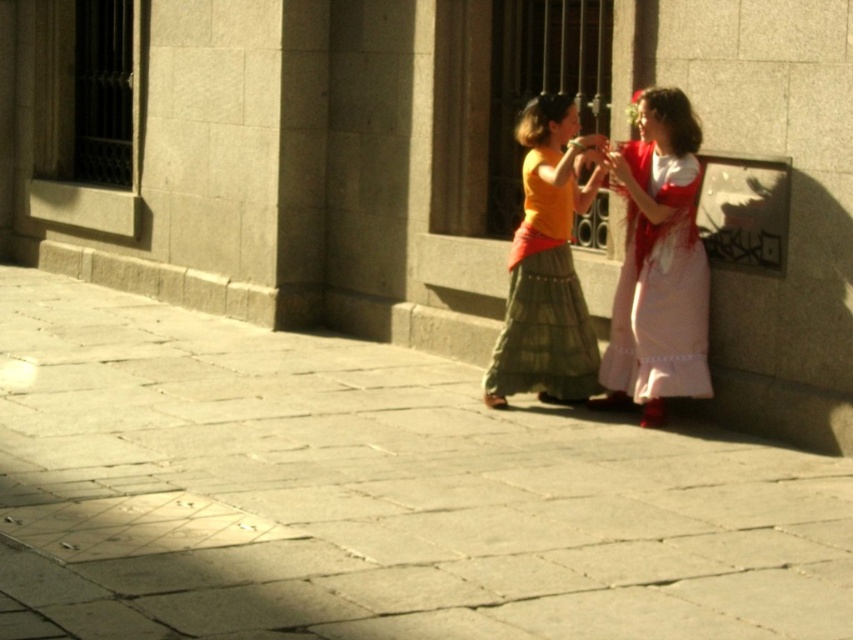
Between smooth stone pavement at center and matte yellow blouse at center, which one appears on the right side from the viewer's perspective?

matte yellow blouse at center is more to the right.

Does smooth stone pavement at center have a lesser height compared to matte yellow blouse at center?

Yes, smooth stone pavement at center is shorter than matte yellow blouse at center.

At what (x,y) coordinates should I click in order to perform the action: click on smooth stone pavement at center. Please return your answer as a coordinate pair (x, y). The height and width of the screenshot is (640, 853). Looking at the image, I should click on (370, 496).

This screenshot has height=640, width=853. I want to click on smooth stone pavement at center, so click(x=370, y=496).

Who is more distant from viewer, (543,618) or (660,256)?

The point (660,256) is more distant.

Between smooth stone pavement at center and matte red dress at center, which one appears on the right side from the viewer's perspective?

matte red dress at center

Image resolution: width=853 pixels, height=640 pixels. Identify the location of smooth stone pavement at center. (370, 496).

Is the position of smooth stone pavement at center more distant than that of silky white flower at upper right?

No, it is in front of silky white flower at upper right.

Who is shorter, smooth stone pavement at center or silky white flower at upper right?

smooth stone pavement at center is shorter.

At what (x,y) coordinates should I click in order to perform the action: click on smooth stone pavement at center. Please return your answer as a coordinate pair (x, y). Looking at the image, I should click on (370, 496).

The width and height of the screenshot is (853, 640). In order to click on smooth stone pavement at center in this screenshot , I will do (370, 496).